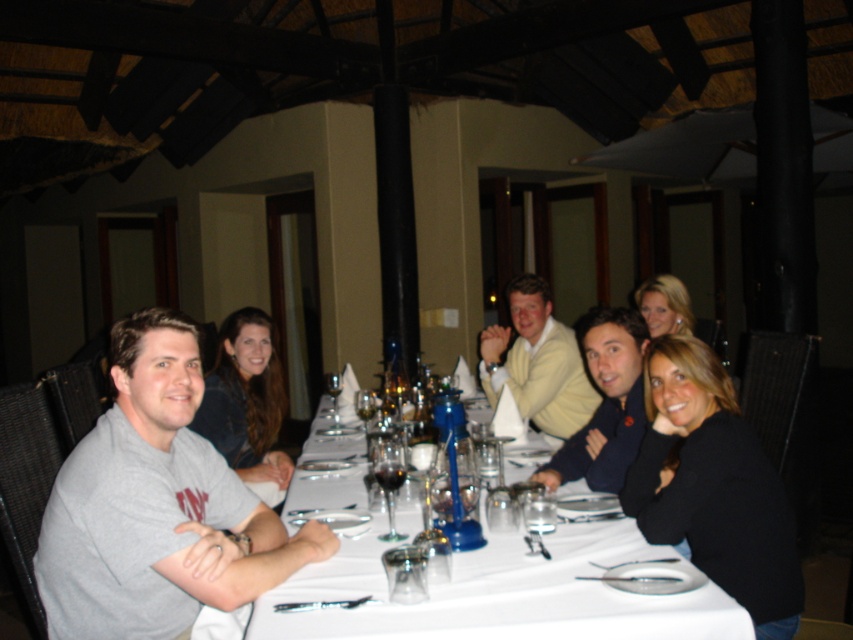
Question: Is black sweater at upper right thinner than matte gray shirt at center?

Choices:
 (A) no
 (B) yes

Answer: (B)

Question: Can you confirm if transparent glass at table center is smaller than clear glass wine glass at center?

Choices:
 (A) yes
 (B) no

Answer: (B)

Question: Among these points, which one is nearest to the camera?

Choices:
 (A) (258, 308)
 (B) (616, 369)
 (C) (218, 474)

Answer: (C)

Question: Does matte gray shirt at center come in front of clear glass wine glass at center?

Choices:
 (A) yes
 (B) no

Answer: (A)

Question: Among these objects, which one is nearest to the camera?

Choices:
 (A) dark blue sweater at center
 (B) transparent glass at table center

Answer: (B)

Question: Among these objects, which one is farthest from the camera?

Choices:
 (A) matte gray shirt at center
 (B) clear glass wine glass at center
 (C) transparent glass at table center
 (D) gray cotton shirt at left

Answer: (B)